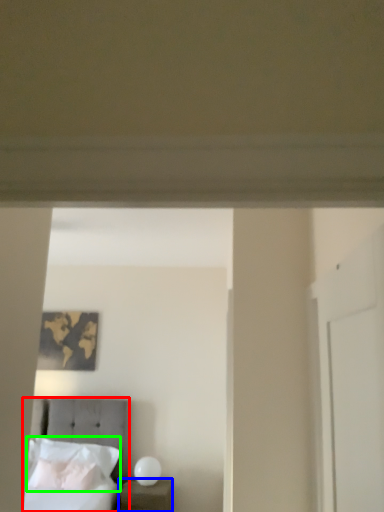
Question: Which object is the farthest from bed (highlighted by a red box)? Choose among these: nightstand (highlighted by a blue box) or pillow (highlighted by a green box).

Choices:
 (A) nightstand
 (B) pillow

Answer: (A)